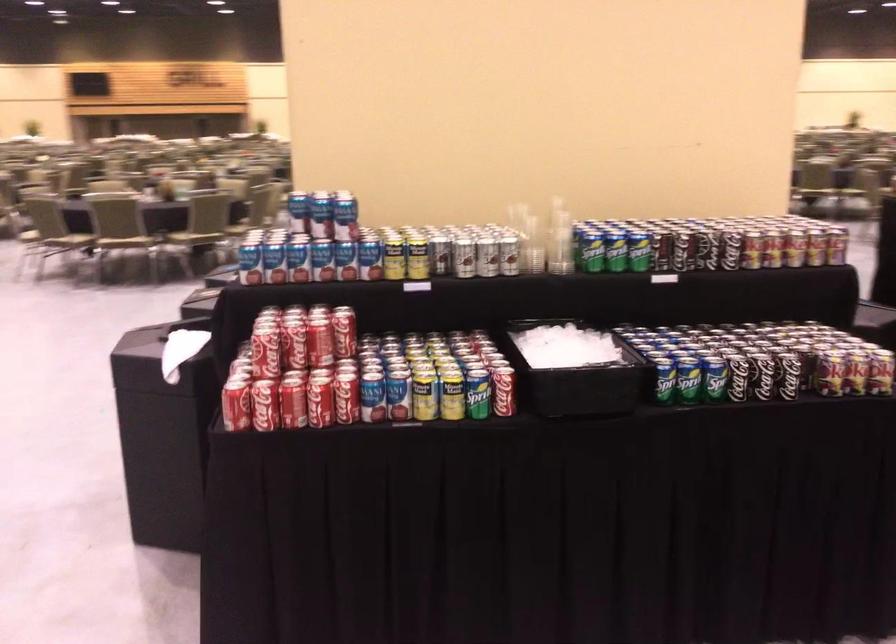
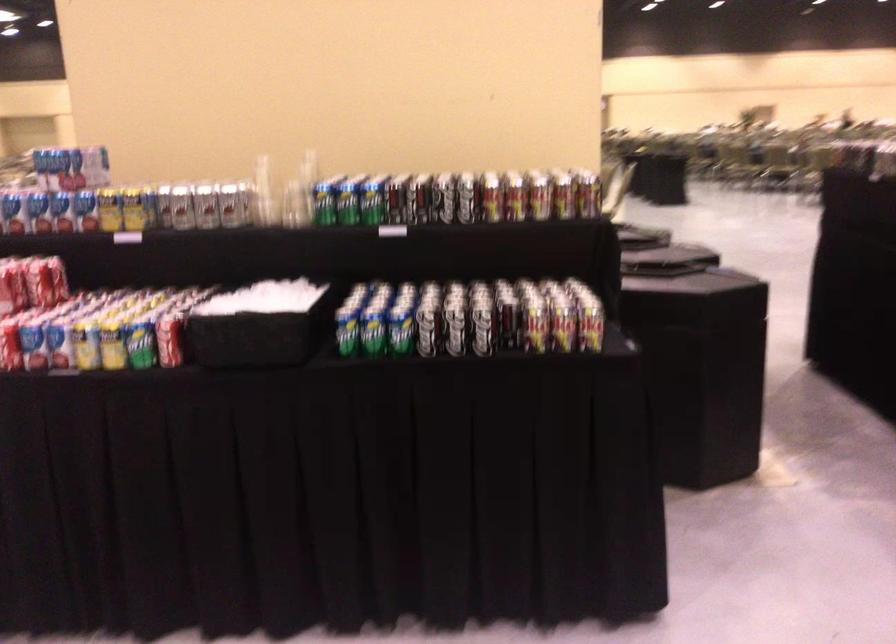
Where in the second image is the point corresponding to (490,256) from the first image?

(205, 205)